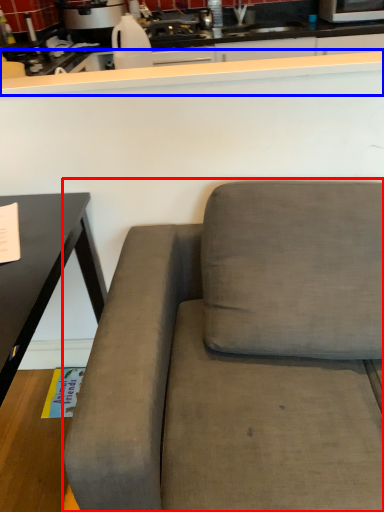
Question: Which of the following is the farthest to the observer, studio couch (highlighted by a red box) or counter top (highlighted by a blue box)?

Choices:
 (A) studio couch
 (B) counter top

Answer: (B)